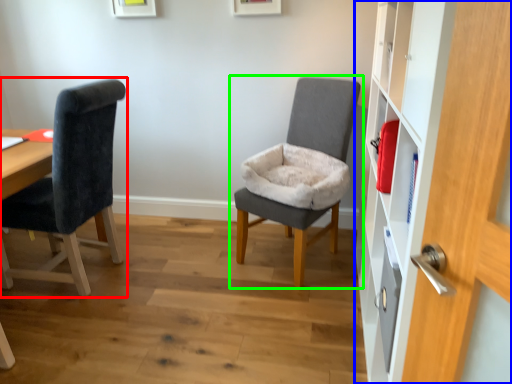
Question: Considering the real-world distances, which object is farthest from chair (highlighted by a red box)? dresser (highlighted by a blue box) or chair (highlighted by a green box)?

Choices:
 (A) dresser
 (B) chair

Answer: (A)